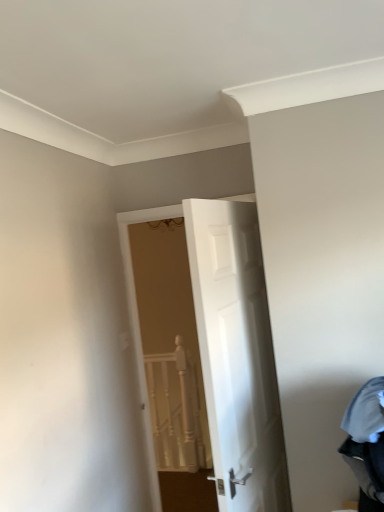
Question: From a real-world perspective, is white glossy door at center below white textured rail at center?

Choices:
 (A) no
 (B) yes

Answer: (A)

Question: Does white glossy door at center turn towards white textured rail at center?

Choices:
 (A) yes
 (B) no

Answer: (B)

Question: Does white glossy door at center lie behind white textured rail at center?

Choices:
 (A) yes
 (B) no

Answer: (B)

Question: Is white glossy door at center at the left side of white textured rail at center?

Choices:
 (A) no
 (B) yes

Answer: (A)

Question: Does white glossy door at center have a lesser height compared to white textured rail at center?

Choices:
 (A) yes
 (B) no

Answer: (B)

Question: From the image's perspective, relative to denim fabric laundry at lower right, is white textured rail at center above or below?

Choices:
 (A) above
 (B) below

Answer: (B)

Question: In terms of size, does white textured rail at center appear bigger or smaller than denim fabric laundry at lower right?

Choices:
 (A) big
 (B) small

Answer: (B)

Question: Looking at their shapes, would you say white textured rail at center is wider or thinner than denim fabric laundry at lower right?

Choices:
 (A) wide
 (B) thin

Answer: (B)

Question: From a real-world perspective, relative to denim fabric laundry at lower right, is white textured rail at center vertically above or below?

Choices:
 (A) above
 (B) below

Answer: (B)

Question: From the image's perspective, is white glossy door at center located above or below white textured rail at center?

Choices:
 (A) below
 (B) above

Answer: (B)

Question: Considering the positions of white glossy door at center and white textured rail at center in the image, is white glossy door at center taller or shorter than white textured rail at center?

Choices:
 (A) short
 (B) tall

Answer: (B)

Question: In the image, is white glossy door at center positioned in front of or behind white textured rail at center?

Choices:
 (A) front
 (B) behind

Answer: (A)

Question: From a real-world perspective, relative to white textured rail at center, is white glossy door at center vertically above or below?

Choices:
 (A) above
 (B) below

Answer: (A)

Question: From a real-world perspective, is white textured rail at center above or below white glossy door at center?

Choices:
 (A) above
 (B) below

Answer: (B)

Question: In terms of height, does white textured rail at center look taller or shorter compared to white glossy door at center?

Choices:
 (A) short
 (B) tall

Answer: (A)